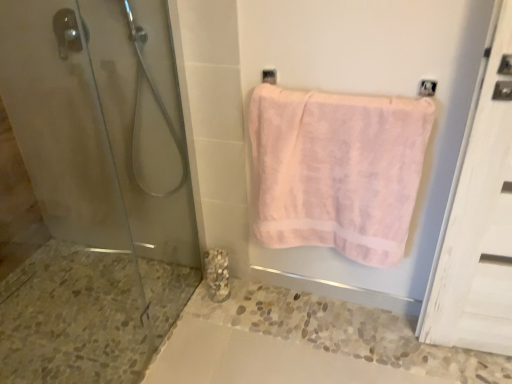
Question: Does marble textured at lower left appear on the left side of clear glass shower at left?

Choices:
 (A) yes
 (B) no

Answer: (B)

Question: From the image's perspective, would you say marble textured at lower left is shown under clear glass shower at left?

Choices:
 (A) yes
 (B) no

Answer: (A)

Question: Is marble textured at lower left aimed at clear glass shower at left?

Choices:
 (A) no
 (B) yes

Answer: (A)

Question: Does marble textured at lower left have a lesser width compared to clear glass shower at left?

Choices:
 (A) no
 (B) yes

Answer: (A)

Question: Is marble textured at lower left surrounding clear glass shower at left?

Choices:
 (A) no
 (B) yes

Answer: (A)

Question: Is marble textured at lower left shorter than clear glass shower at left?

Choices:
 (A) no
 (B) yes

Answer: (B)

Question: Considering the relative sizes of pink fluffy towel at upper right and marble textured at lower left in the image provided, is pink fluffy towel at upper right thinner than marble textured at lower left?

Choices:
 (A) yes
 (B) no

Answer: (B)

Question: Does pink fluffy towel at upper right have a greater height compared to marble textured at lower left?

Choices:
 (A) no
 (B) yes

Answer: (B)

Question: From a real-world perspective, does pink fluffy towel at upper right sit lower than marble textured at lower left?

Choices:
 (A) no
 (B) yes

Answer: (A)

Question: Does pink fluffy towel at upper right have a lesser height compared to marble textured at lower left?

Choices:
 (A) yes
 (B) no

Answer: (B)

Question: Can you confirm if pink fluffy towel at upper right is positioned to the right of marble textured at lower left?

Choices:
 (A) yes
 (B) no

Answer: (A)

Question: Does pink fluffy towel at upper right lie behind marble textured at lower left?

Choices:
 (A) yes
 (B) no

Answer: (B)

Question: Can you confirm if pink fluffy towel at upper right is bigger than clear glass shower at left?

Choices:
 (A) no
 (B) yes

Answer: (B)